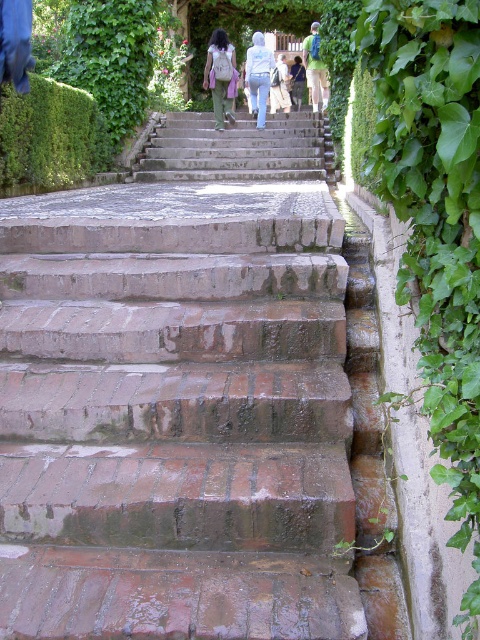
Question: Does stone steps at center come behind white matte jacket at upper center?

Choices:
 (A) yes
 (B) no

Answer: (B)

Question: Does brown brick stairs at center appear over light beige backpack at center?

Choices:
 (A) no
 (B) yes

Answer: (A)

Question: Estimate the real-world distances between objects in this image. Which object is closer to the stone steps at center?

Choices:
 (A) white matte jacket at upper center
 (B) light beige backpack at center

Answer: (B)

Question: Which object is farther from the camera taking this photo?

Choices:
 (A) green leafy ivy at right
 (B) green backpack at upper center
 (C) brown brick stairs at center

Answer: (B)

Question: Is stone steps at center above light blue jeans at center?

Choices:
 (A) yes
 (B) no

Answer: (B)

Question: Which point appears farthest from the camera in this image?

Choices:
 (A) (313, 61)
 (B) (277, 72)

Answer: (B)